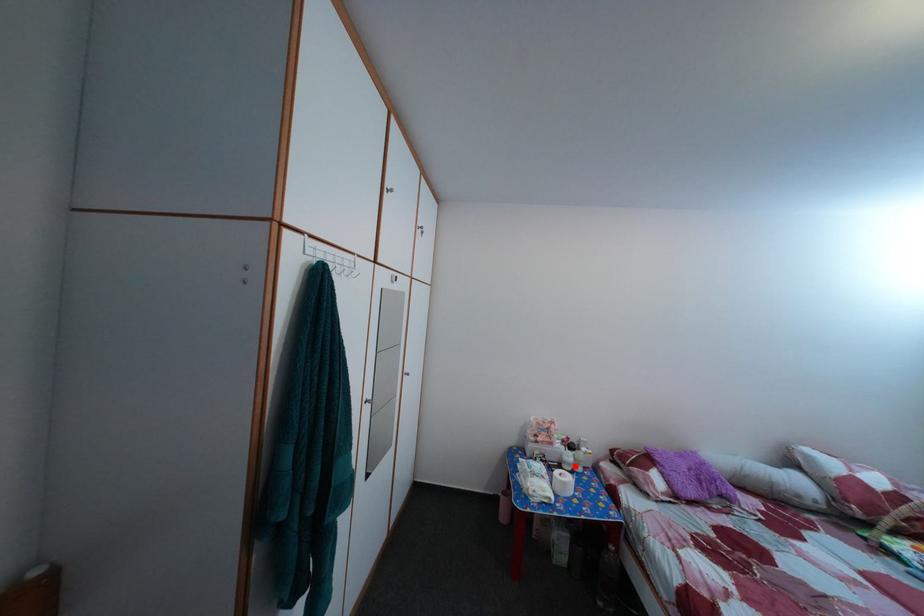
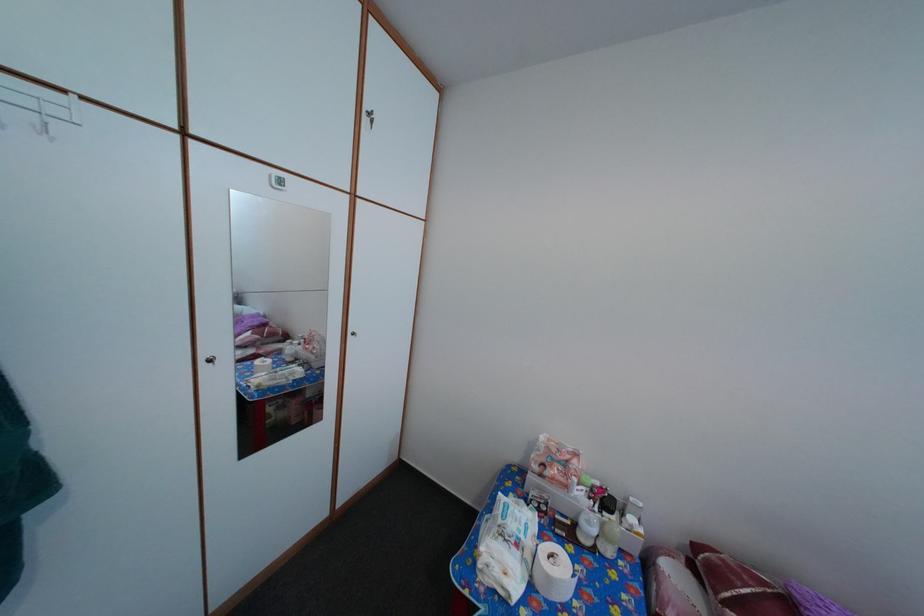
The point at the highlighted location is marked in the first image. Where is the corresponding point in the second image?

(592, 531)